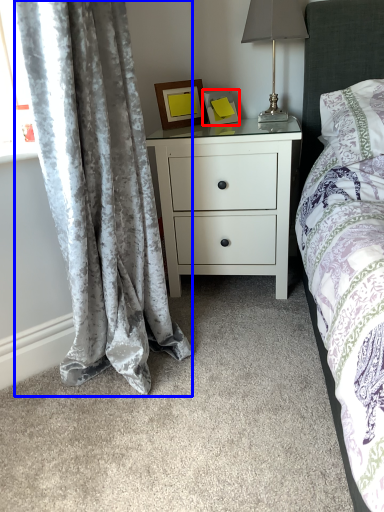
Question: Among these objects, which one is farthest to the camera, picture frame (highlighted by a red box) or curtain (highlighted by a blue box)?

Choices:
 (A) picture frame
 (B) curtain

Answer: (A)